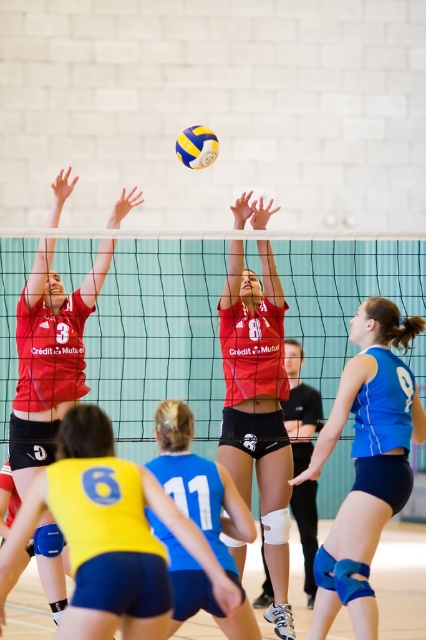
You are a volleyball coach observing the match. You notice the green mesh net at center and the blue jersey at center. Which object is positioned higher in the image?

The green mesh net at center is located above the blue jersey at center, so it is positioned higher in the image.

Based on the photo, you are a photographer standing at the back of the gymnasium. You want to take a closeup photo of the matte red volleyball at center. The camera you are using has a maximum zoom range of 20 feet. Can you capture a clear closeup without moving closer?

The matte red volleyball at center is 26.63 feet away from the camera. Since the maximum zoom range is 20 feet, the camera cannot capture a clear closeup of the matte red volleyball at center without moving closer.